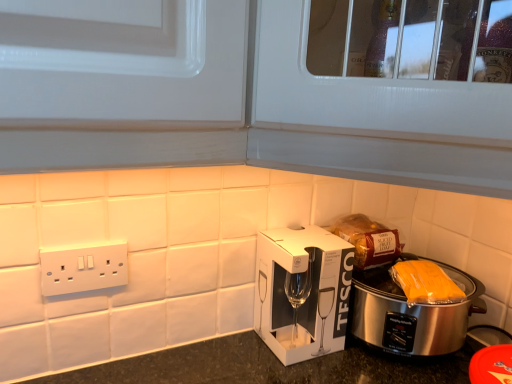
Question: Can you confirm if silver metallic slow cooker at lower right is taller than white textured cabinet at upper center?

Choices:
 (A) yes
 (B) no

Answer: (B)

Question: Does silver metallic slow cooker at lower right have a larger size compared to white textured cabinet at upper center?

Choices:
 (A) yes
 (B) no

Answer: (B)

Question: Is silver metallic slow cooker at lower right to the right of white textured cabinet at upper center from the viewer's perspective?

Choices:
 (A) no
 (B) yes

Answer: (B)

Question: Is the position of silver metallic slow cooker at lower right more distant than that of white textured cabinet at upper center?

Choices:
 (A) no
 (B) yes

Answer: (B)

Question: From the image's perspective, does silver metallic slow cooker at lower right appear higher than white textured cabinet at upper center?

Choices:
 (A) no
 (B) yes

Answer: (A)

Question: From a real-world perspective, is silver metallic slow cooker at lower right positioned above or below white cardboard box at center?

Choices:
 (A) below
 (B) above

Answer: (A)

Question: Visually, is silver metallic slow cooker at lower right positioned to the left or to the right of white cardboard box at center?

Choices:
 (A) left
 (B) right

Answer: (B)

Question: From the image's perspective, is silver metallic slow cooker at lower right located above or below white cardboard box at center?

Choices:
 (A) below
 (B) above

Answer: (A)

Question: In terms of width, does silver metallic slow cooker at lower right look wider or thinner when compared to white cardboard box at center?

Choices:
 (A) thin
 (B) wide

Answer: (B)

Question: Based on their sizes in the image, would you say white cardboard box at center is bigger or smaller than silver metallic slow cooker at lower right?

Choices:
 (A) small
 (B) big

Answer: (A)

Question: Is point (254, 306) closer or farther from the camera than point (359, 294)?

Choices:
 (A) closer
 (B) farther

Answer: (B)

Question: Considering the positions of white cardboard box at center and silver metallic slow cooker at lower right in the image, is white cardboard box at center wider or thinner than silver metallic slow cooker at lower right?

Choices:
 (A) wide
 (B) thin

Answer: (B)

Question: Is white cardboard box at center spatially inside silver metallic slow cooker at lower right, or outside of it?

Choices:
 (A) outside
 (B) inside

Answer: (A)

Question: From a real-world perspective, relative to white textured cabinet at upper center, is yellow plastic bag at right vertically above or below?

Choices:
 (A) below
 (B) above

Answer: (A)

Question: Is point (428, 284) positioned closer to the camera than point (369, 172)?

Choices:
 (A) farther
 (B) closer

Answer: (A)